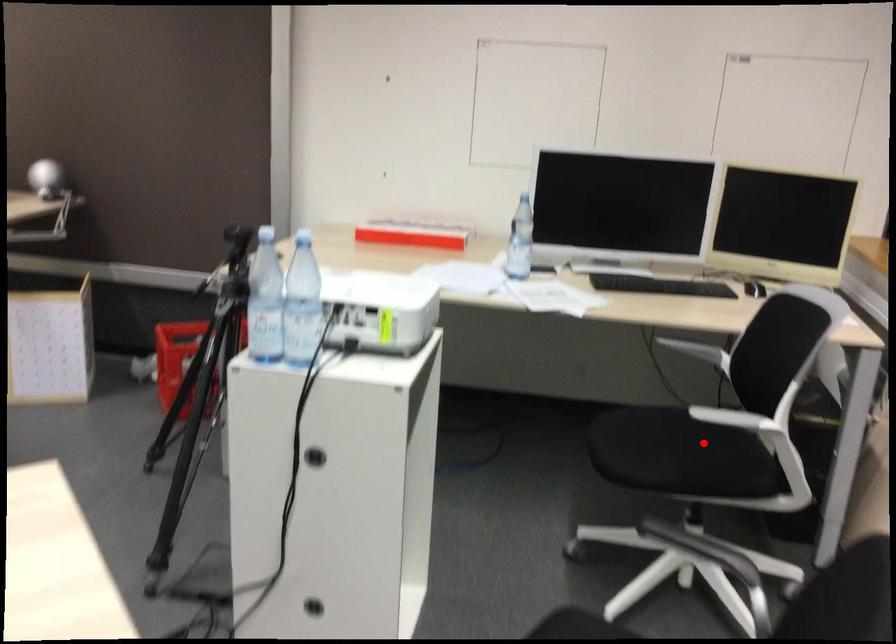
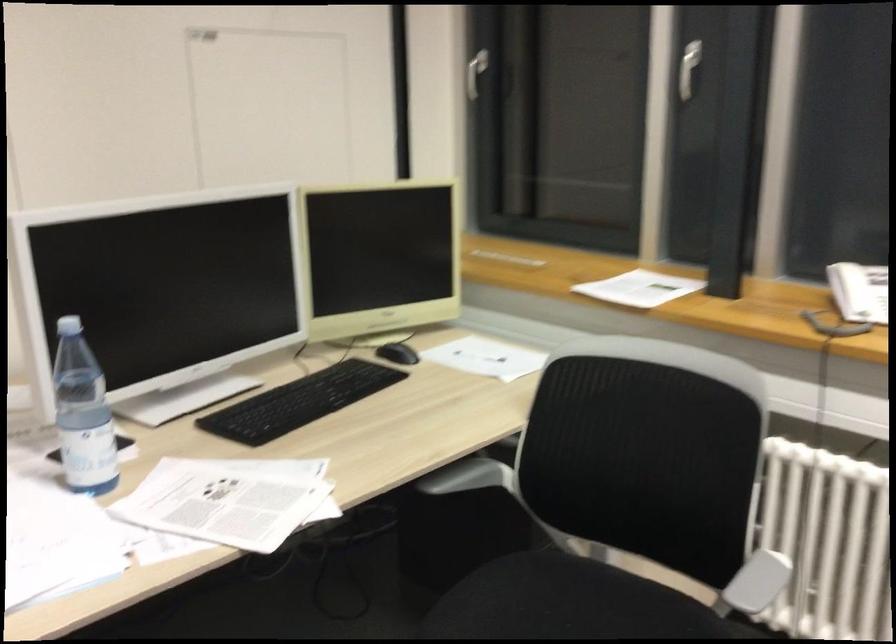
Question: A red point is marked in image1. In image2, is the corresponding 3D point closer to the camera or farther? Reply with the corresponding letter.

Choices:
 (A) The corresponding 3D point is closer.
 (B) The corresponding 3D point is farther.

Answer: (A)